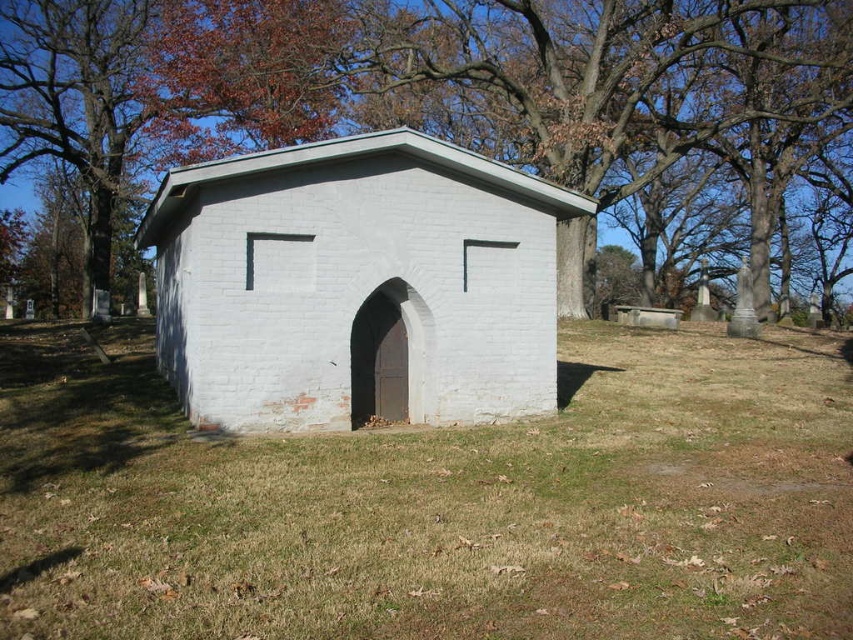
From the picture: You are standing at the point marked by the coordinates point (434, 502). Looking around, you see the small white brick structure with an arched doorway and two windows above it. What is directly under your feet?

The point (434, 502) corresponds to green grass at center, so the green grass at center is directly under your feet.

You are standing at the entrance of the white brick structure and want to walk to the green grass at center. What direction should you head?

Since the green grass at center is located at point (434, 502) in 2D coordinates, you should head forward from the entrance to reach it.

You are a gardener planning to mow the green grass at center and trim the brown wood tree at upper center. Which task requires more attention to the size of the area or object?

The brown wood tree at upper center requires more attention because the green grass at center has a smaller width compared to the brown wood tree at upper center.